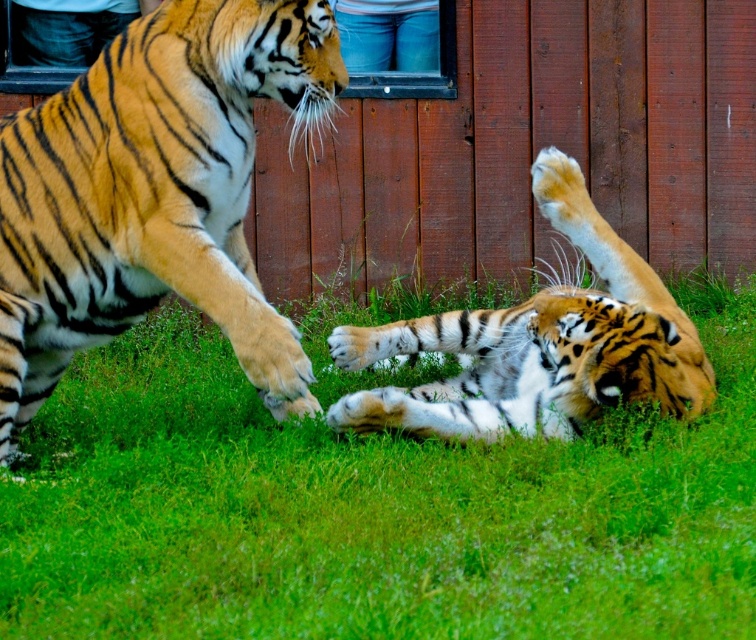
Is orange fur tiger at left shorter than orange and black striped tiger at lower right?

No, orange fur tiger at left is not shorter than orange and black striped tiger at lower right.

Which is behind, point (42, 378) or point (562, 216)?

The point (562, 216) is more distant.

Who is more forward, (29, 260) or (682, 316)?

Point (29, 260)

What are the coordinates of `orange fur tiger at left` in the screenshot? It's located at (153, 193).

Is green grass at center bigger than orange and black striped tiger at lower right?

Yes.

Can you confirm if green grass at center is positioned above orange and black striped tiger at lower right?

Actually, green grass at center is below orange and black striped tiger at lower right.

Does point (64, 384) come behind point (372, 353)?

Yes, point (64, 384) is farther from viewer.

Find the location of a particular element. The width and height of the screenshot is (756, 640). green grass at center is located at coordinates (372, 509).

Does green grass at center appear on the left side of orange fur tiger at left?

No, green grass at center is not to the left of orange fur tiger at left.

From the picture: Is green grass at center further to camera compared to orange fur tiger at left?

That is False.

Is point (113, 352) positioned behind point (313, 24)?

Yes, point (113, 352) is behind point (313, 24).

You are a GUI agent. You are given a task and a screenshot of the screen. Output one action in this format:
    pyautogui.click(x=<x>, y=<y>)
    Task: Click on the green grass at center
    This screenshot has height=640, width=756.
    Given the screenshot: What is the action you would take?
    pyautogui.click(x=372, y=509)